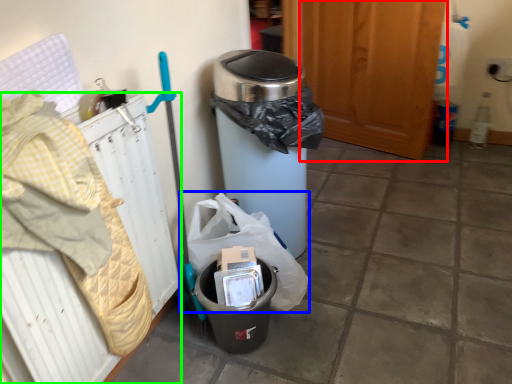
Question: Which object is the closest to the screen door (highlighted by a red box)? Choose among these: garbage (highlighted by a blue box) or radiator (highlighted by a green box).

Choices:
 (A) garbage
 (B) radiator

Answer: (A)